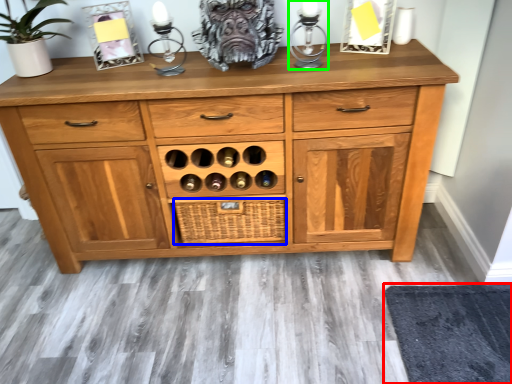
Question: Which object is the closest to the mat (highlighted by a red box)? Choose among these: crate (highlighted by a blue box) or candle holder (highlighted by a green box).

Choices:
 (A) crate
 (B) candle holder

Answer: (A)